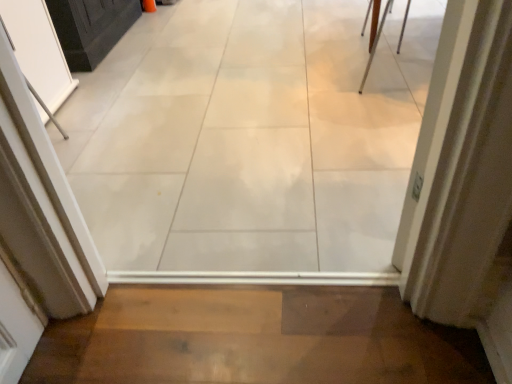
In order to click on white glossy screen door at left in this screenshot , I will do `click(38, 50)`.

What do you see at coordinates (38, 50) in the screenshot? I see `white glossy screen door at left` at bounding box center [38, 50].

The image size is (512, 384). I want to click on white glossy screen door at left, so click(38, 50).